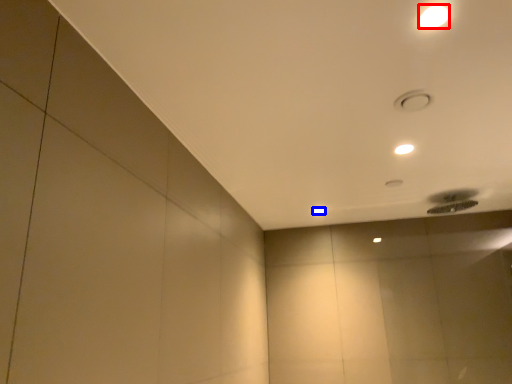
Question: Which of the following is the farthest to the observer, lamp (highlighted by a red box) or lamp (highlighted by a blue box)?

Choices:
 (A) lamp
 (B) lamp

Answer: (B)